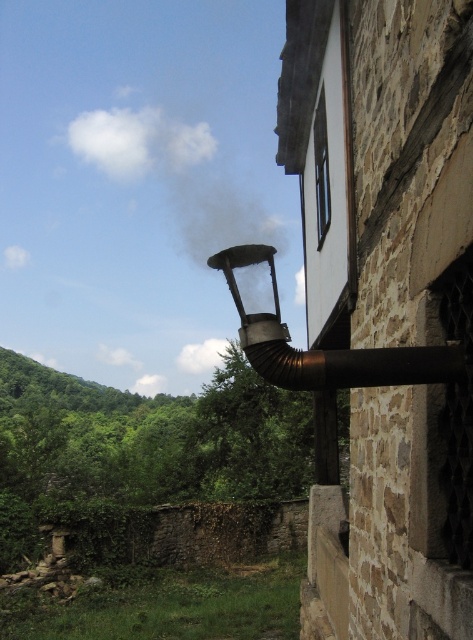
Question: Is white smoke at upper center below bronze metallic chimney at upper right?

Choices:
 (A) no
 (B) yes

Answer: (A)

Question: Does white smoke at upper center have a lesser width compared to bronze metallic chimney at upper right?

Choices:
 (A) yes
 (B) no

Answer: (B)

Question: Which point is closer to the camera taking this photo?

Choices:
 (A) (458, 342)
 (B) (88, 115)

Answer: (A)

Question: Does white smoke at upper center appear on the right side of bronze metallic chimney at upper right?

Choices:
 (A) yes
 (B) no

Answer: (B)

Question: Which of the following is the closest to the observer?

Choices:
 (A) (152, 144)
 (B) (266, 316)

Answer: (B)